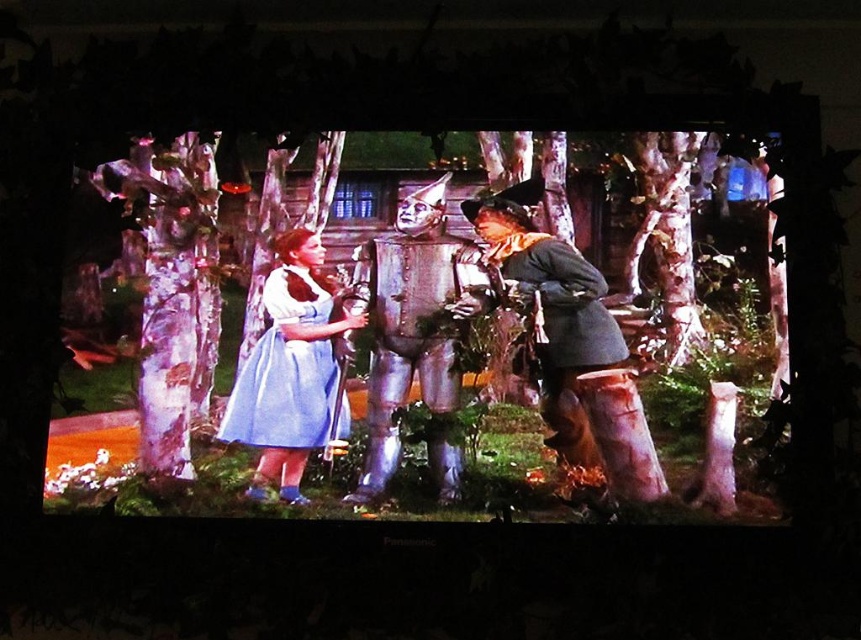
Can you confirm if metallic silver robot at center is positioned to the left of light blue satin dress at center?

No, metallic silver robot at center is not to the left of light blue satin dress at center.

Does metallic silver robot at center have a larger size compared to light blue satin dress at center?

Correct, metallic silver robot at center is larger in size than light blue satin dress at center.

The image size is (861, 640). In order to click on metallic silver robot at center in this screenshot , I will do `click(414, 336)`.

Is rusty metal man at center shorter than light blue satin dress at center?

No.

From the picture: Which is more to the right, rusty metal man at center or light blue satin dress at center?

Positioned to the right is rusty metal man at center.

Is point (503, 202) in front of point (257, 412)?

That is False.

You are a GUI agent. You are given a task and a screenshot of the screen. Output one action in this format:
    pyautogui.click(x=<x>, y=<y>)
    Task: Click on the rusty metal man at center
    
    Given the screenshot: What is the action you would take?
    pyautogui.click(x=550, y=312)

Between metallic silver robot at center and rusty metal man at center, which one appears on the right side from the viewer's perspective?

Positioned to the right is rusty metal man at center.

Does metallic silver robot at center have a greater width compared to rusty metal man at center?

No.

Who is more forward, (420, 336) or (589, 307)?

Point (589, 307) is more forward.

Where is `metallic silver robot at center`? Image resolution: width=861 pixels, height=640 pixels. metallic silver robot at center is located at coordinates (414, 336).